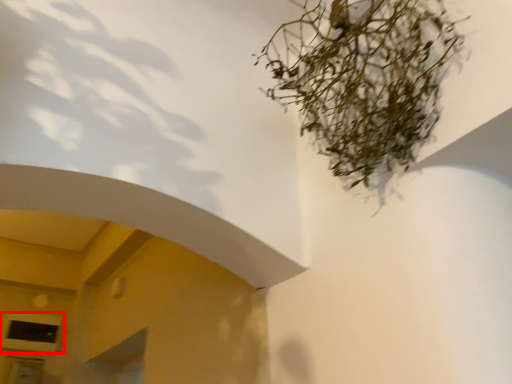
Question: From the image's perspective, considering the relative positions of window (annotated by the red box) and houseplant in the image provided, where is window (annotated by the red box) located with respect to the staircase?

Choices:
 (A) below
 (B) above

Answer: (A)